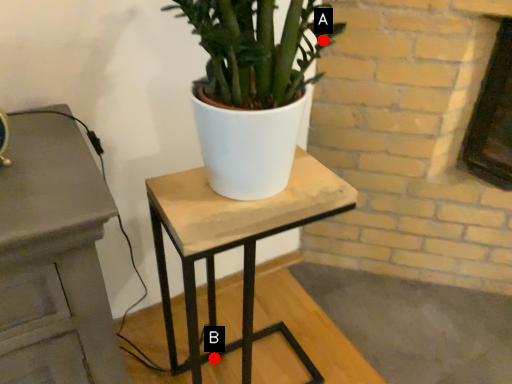
Question: Two points are circled on the image, labeled by A and B beside each circle. Which point is closer to the camera?

Choices:
 (A) A is closer
 (B) B is closer

Answer: (A)